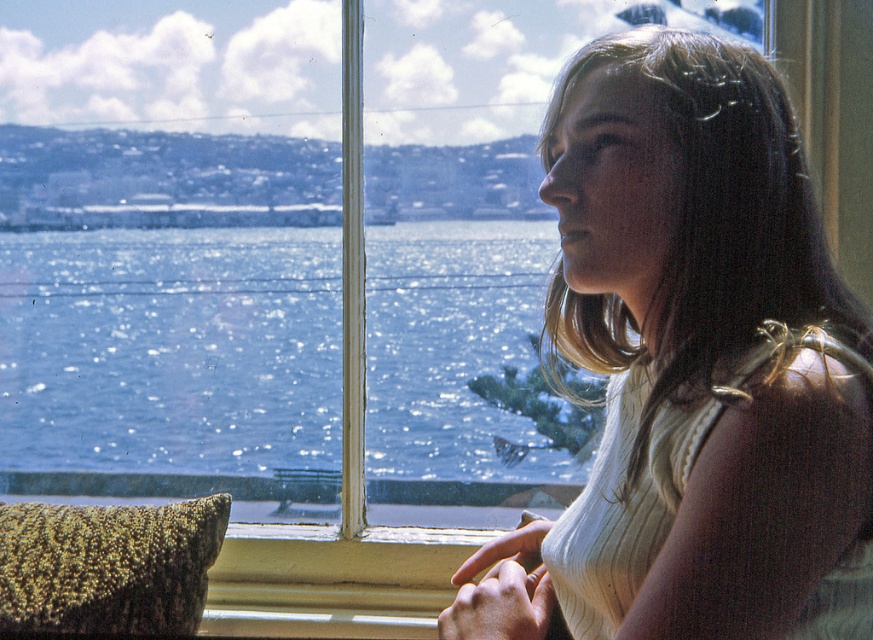
Question: Is white ribbed tank top at center to the left of sparkling blue water at window center from the viewer's perspective?

Choices:
 (A) no
 (B) yes

Answer: (A)

Question: Which object is closer to the camera taking this photo?

Choices:
 (A) green textured pillow at lower left
 (B) sparkling blue water at window center

Answer: (A)

Question: Can you confirm if sparkling blue water at window center is positioned above green textured pillow at lower left?

Choices:
 (A) yes
 (B) no

Answer: (A)

Question: From the image, what is the correct spatial relationship of sparkling blue water at window center in relation to green textured pillow at lower left?

Choices:
 (A) below
 (B) above

Answer: (B)

Question: Which object is closer to the camera taking this photo?

Choices:
 (A) green textured pillow at lower left
 (B) white ribbed tank top at center
 (C) sparkling blue water at window center

Answer: (B)

Question: Which object is positioned closest to the sparkling blue water at window center?

Choices:
 (A) white ribbed tank top at center
 (B) green textured pillow at lower left

Answer: (B)